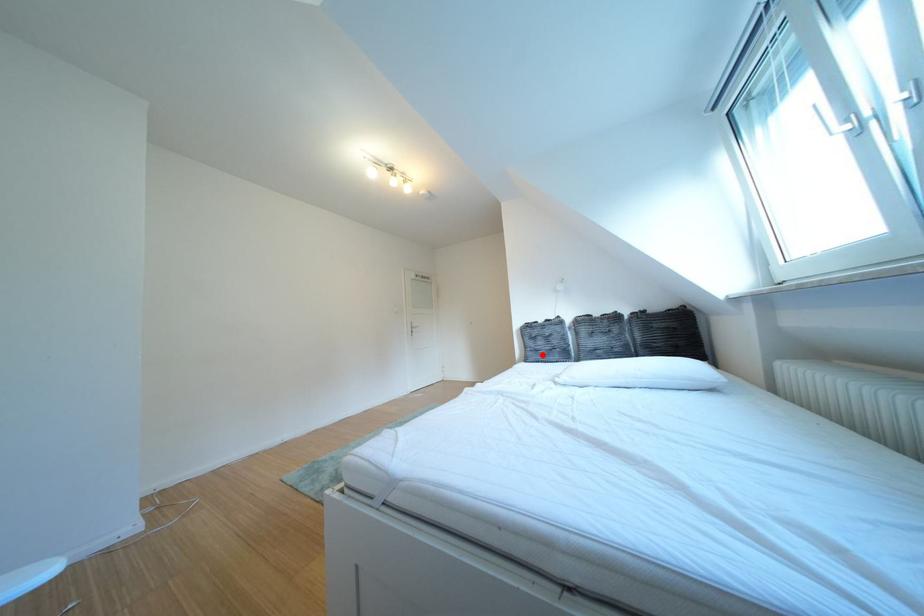
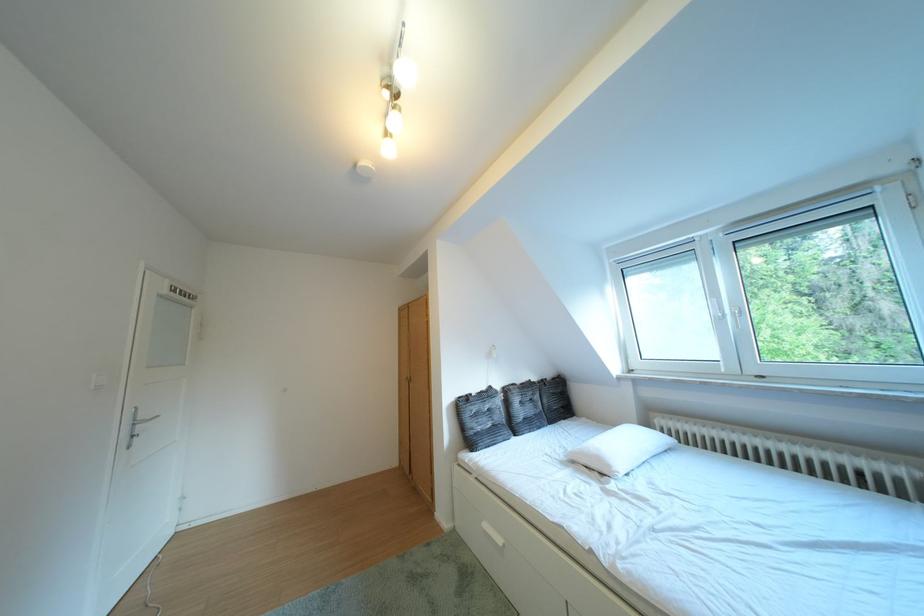
Question: I am providing you with two images of the same scene from different viewpoints. Image1 has a red point marked. In image2, the corresponding 3D location appears at what relative position? Reply with the corresponding letter.

Choices:
 (A) Closer
 (B) Farther

Answer: (B)